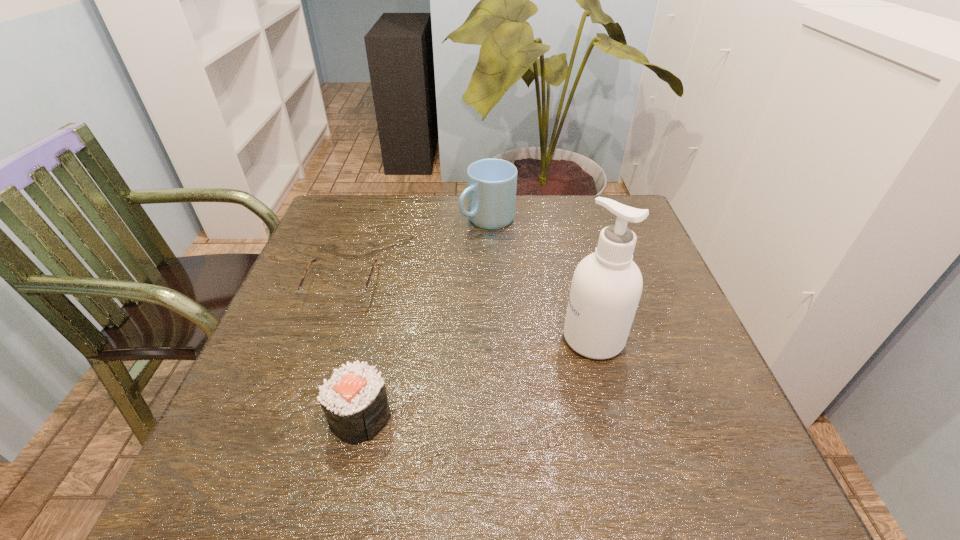
What are the coordinates of `empty space that is in between the third shortest object and the third nearest object` in the screenshot? It's located at (415, 253).

Find the location of a particular element. Image resolution: width=960 pixels, height=540 pixels. free space that is in between the third nearest object and the cleansing agent is located at coordinates (468, 312).

This screenshot has width=960, height=540. Find the location of `free point between the mug and the second nearest object`. free point between the mug and the second nearest object is located at coordinates (540, 279).

Where is `object identified as the second closest to the nearest object`? This screenshot has width=960, height=540. object identified as the second closest to the nearest object is located at coordinates (606, 287).

This screenshot has width=960, height=540. I want to click on the third closest object to the nearest object, so click(x=491, y=188).